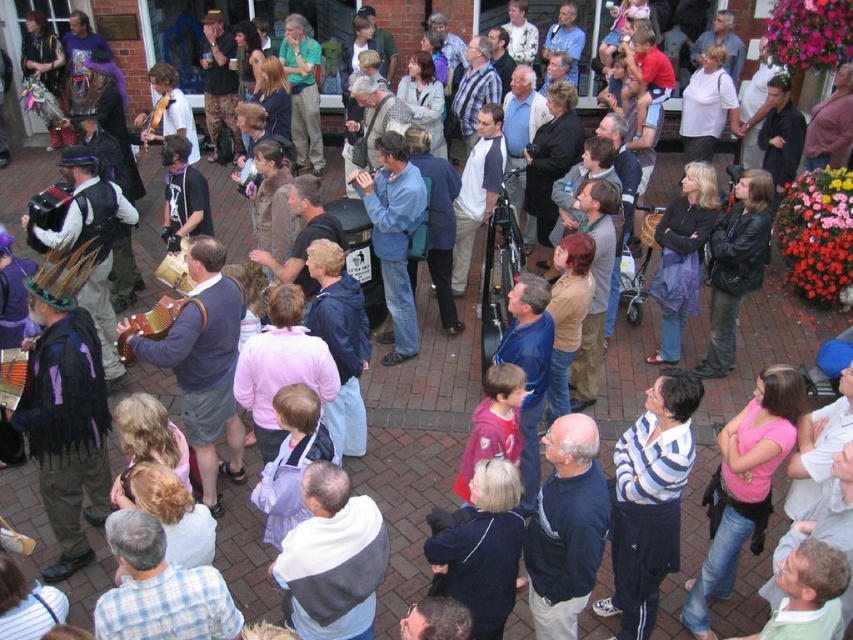
From the picture: You are standing at the edge of the gathering and want to move towards the center. There are two points in the image marked as point 1 at coordinates point (86, 406) and point 2 at coordinates point (44, 195). Which point should you head towards if you want to reach the closest one first?

You should head towards point (86, 406) because it is closer to you than point (44, 195).